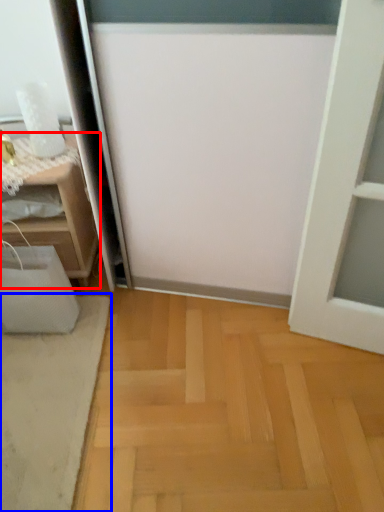
Question: Which of the following is the farthest to the observer, furniture (highlighted by a red box) or doormat (highlighted by a blue box)?

Choices:
 (A) furniture
 (B) doormat

Answer: (A)